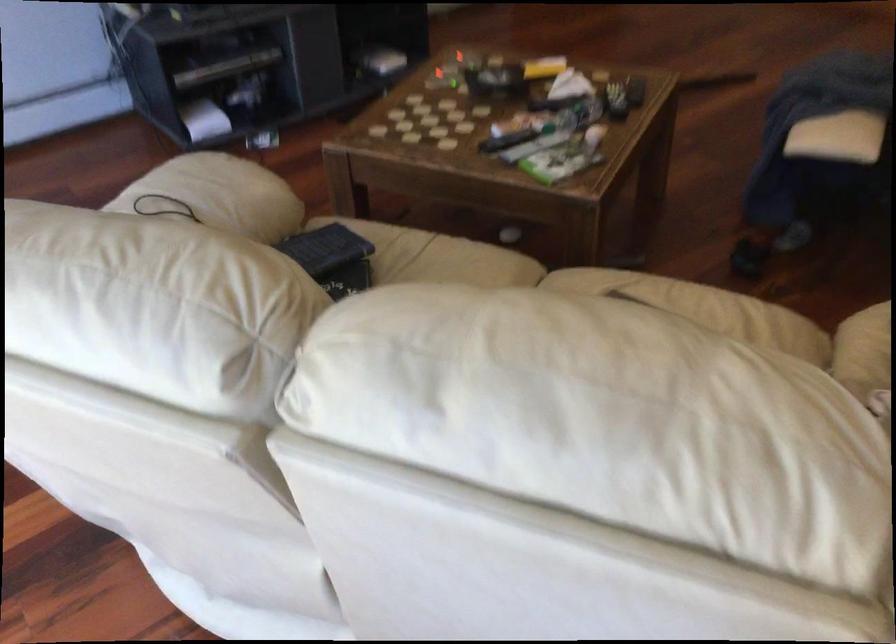
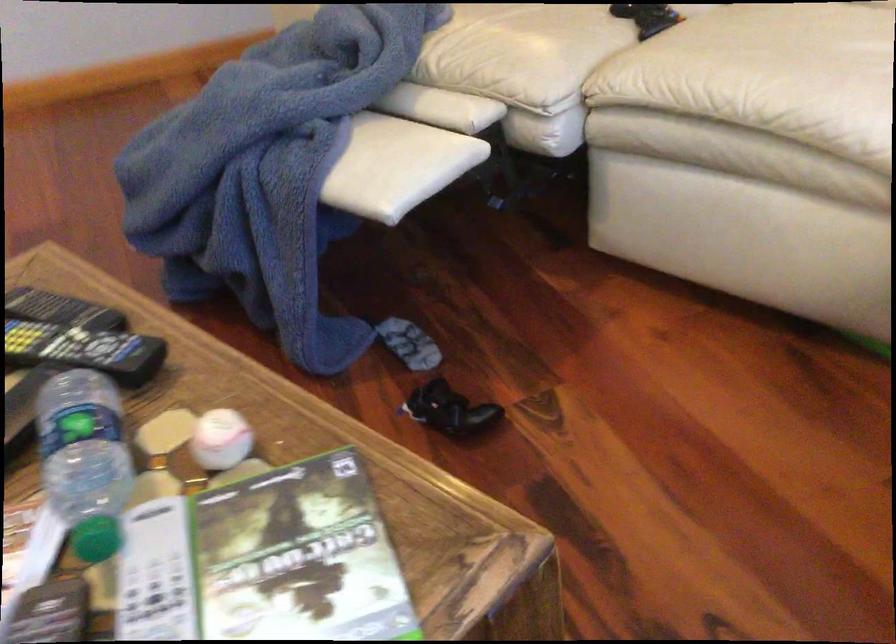
Find the pixel in the second image that matches point (604, 96) in the first image.

(84, 350)